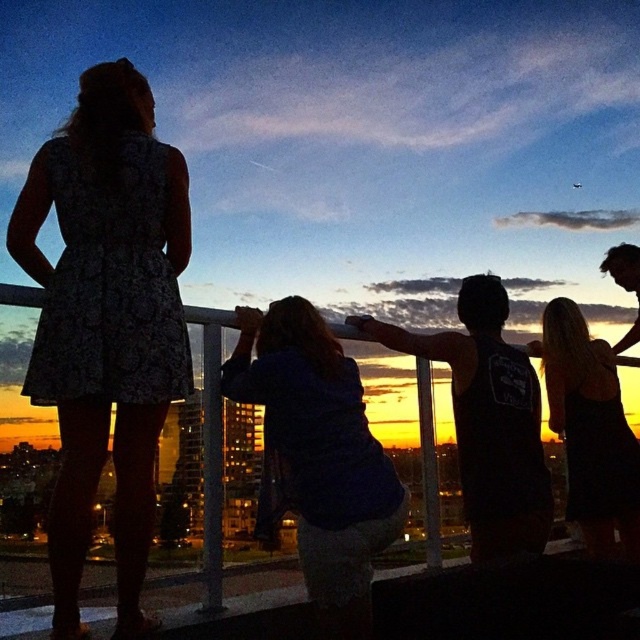
You are standing on the balcony and want to take a photo of the sunset. The camera you have can only capture a small area, so you need to position yourself such that the floral dress at left is exactly at the center of your viewfinder. What coordinate should you aim for?

The floral dress at left is located at coordinate point (106, 321), so you should aim your camera at that coordinate to center it in the viewfinder.